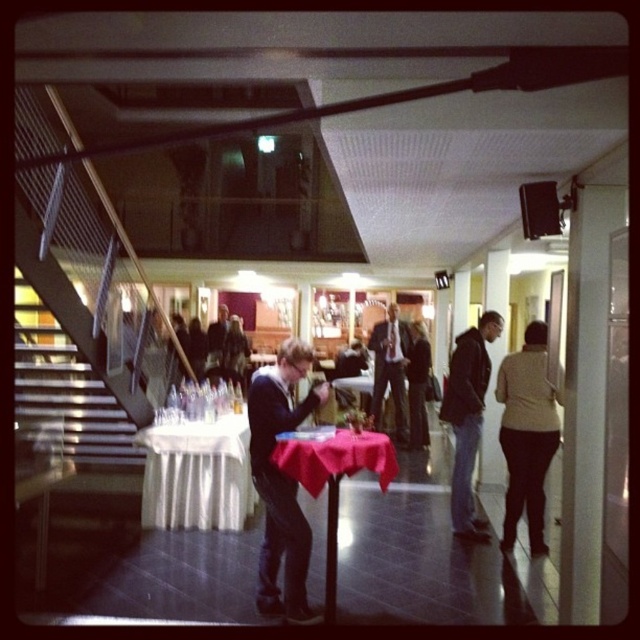
Question: Is smooth red tablecloth at center above dark suit at center?

Choices:
 (A) yes
 (B) no

Answer: (B)

Question: Which of the following is the farthest from the observer?

Choices:
 (A) dark blue jeans at center
 (B) dark suit at center

Answer: (B)

Question: Which point appears farthest from the camera in this image?

Choices:
 (A) (397, 470)
 (B) (442, 401)

Answer: (B)

Question: Is beige sweater at right positioned behind dark suit at center?

Choices:
 (A) no
 (B) yes

Answer: (A)

Question: Can you confirm if smooth red tablecloth at center is wider than dark suit at center?

Choices:
 (A) no
 (B) yes

Answer: (B)

Question: Which object is closer to the camera taking this photo?

Choices:
 (A) dark blue sweater at center
 (B) beige sweater at right
 (C) white satin tablecloth at left
 (D) dark blue jeans at center

Answer: (A)